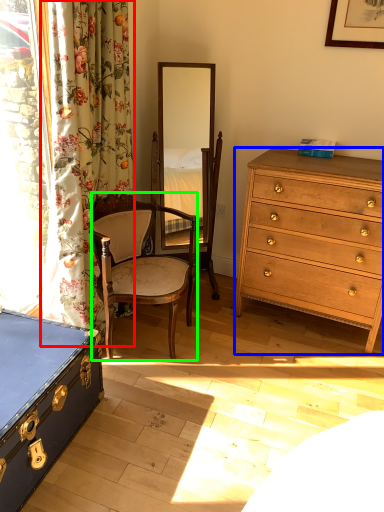
Question: Based on their relative distances, which object is farther from curtain (highlighted by a red box)? Choose from chest of drawers (highlighted by a blue box) and chair (highlighted by a green box).

Choices:
 (A) chest of drawers
 (B) chair

Answer: (A)